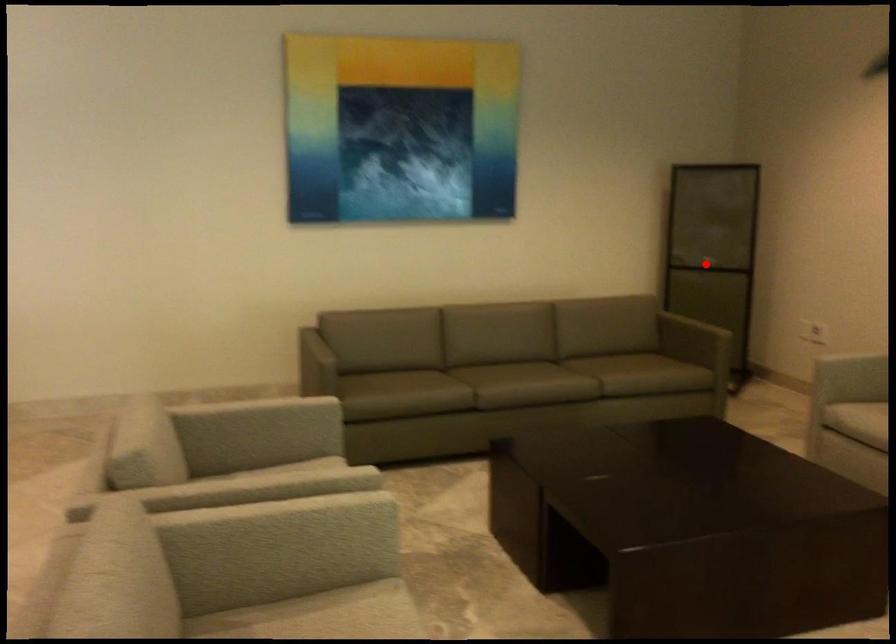
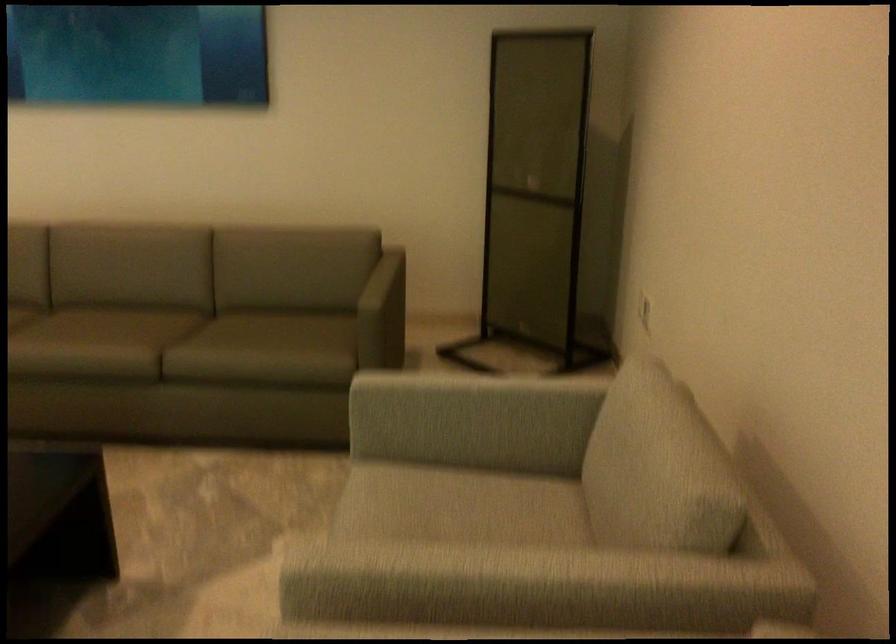
Question: I am providing you with two images of the same scene from different viewpoints. A red point is shown in image1. For the corresponding object point in image2, is it positioned nearer or farther from the camera?

Choices:
 (A) Nearer
 (B) Farther

Answer: (A)